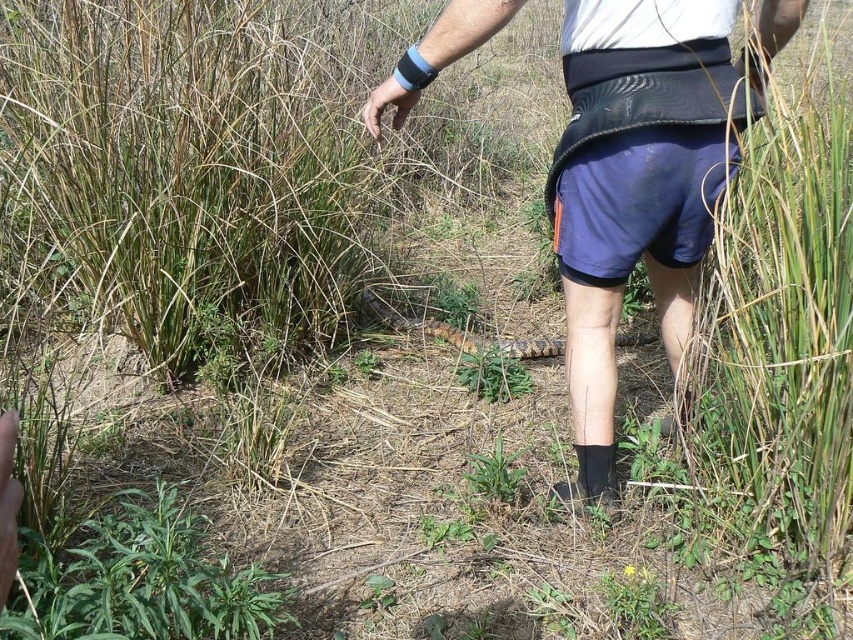
Does blue fabric shorts at center have a smaller size compared to green leafy plant at lower left?

No.

Can you confirm if blue fabric shorts at center is positioned above green leafy plant at lower left?

Yes.

Is point (741, 77) farther from camera compared to point (196, 536)?

Yes, it is behind point (196, 536).

The width and height of the screenshot is (853, 640). I want to click on blue fabric shorts at center, so click(637, 184).